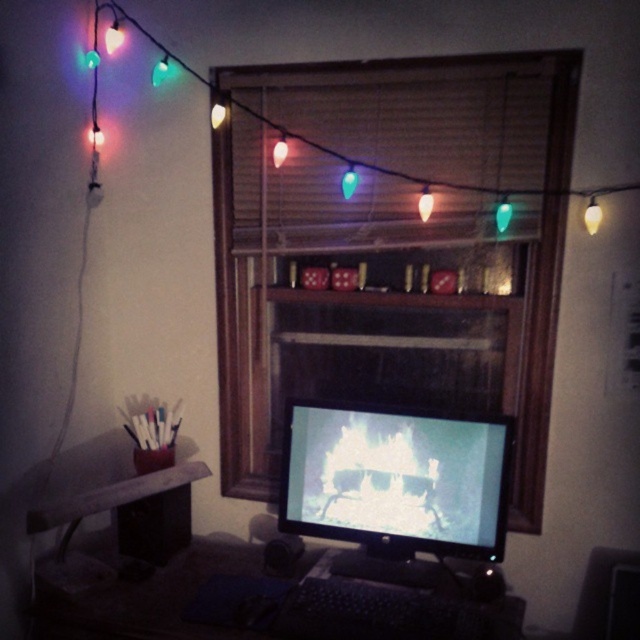
You are organizing your desk and want to place a new item between the black plastic keyboard at lower center and the green translucent bulb at center. Considering their sizes, which object should be placed closer to the edge to leave more space for the new item?

The green translucent bulb at center should be placed closer to the edge because the black plastic keyboard at lower center is wider, so moving the smaller green translucent bulb at center towards the edge would free up more space between them for the new item.

You are organizing items on your desk and need to move the wooden frame at center and the wooden at left. Which object is closer to you so you can reach it first?

The wooden at left is behind wooden frame at center, so the wooden frame at center is closer to you and can be reached first.

You are standing in the room and want to know how far you are from the point marked as point (339, 520). Can you determine the distance?

The distance between you and point (339, 520) is 6.05 feet.